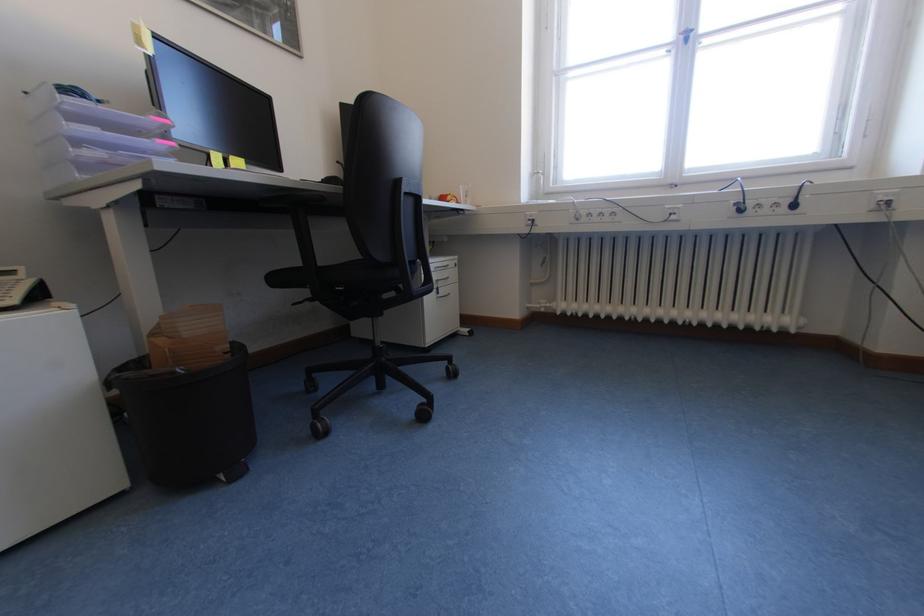
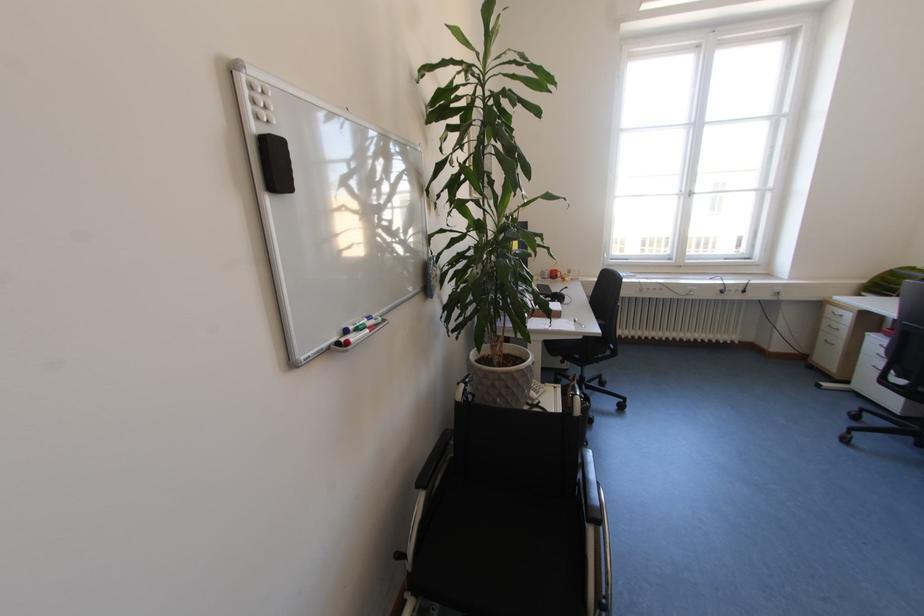
In a continuous first-person perspective shot, in which direction is the camera moving?

The cameraman walked toward left, backward.